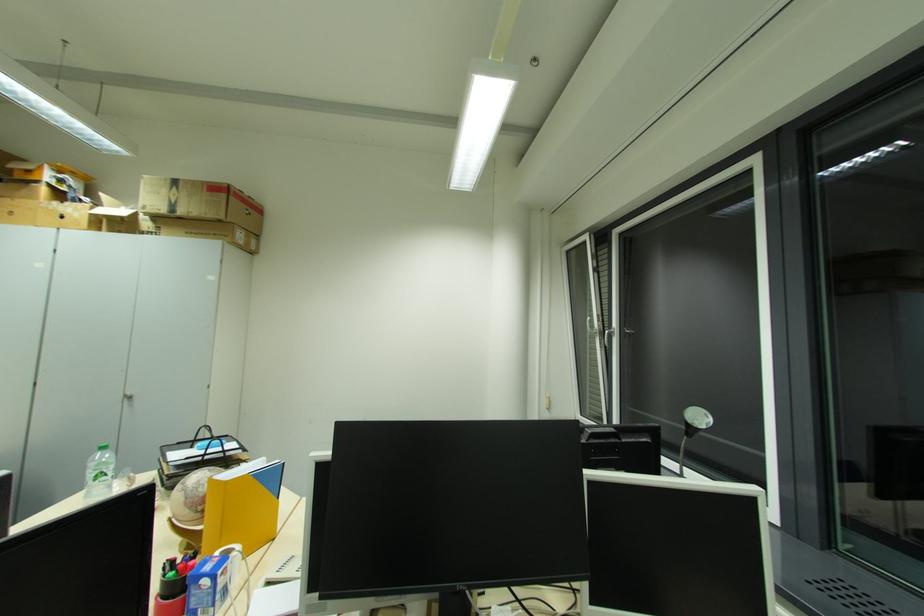
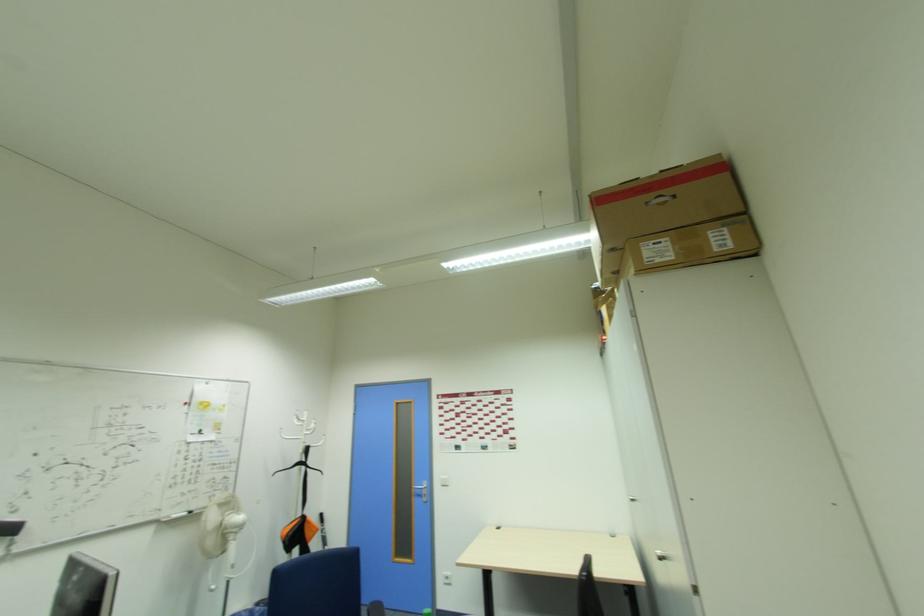
Locate, in the second image, the point that corresponds to point 253,199 in the first image.

(665, 172)